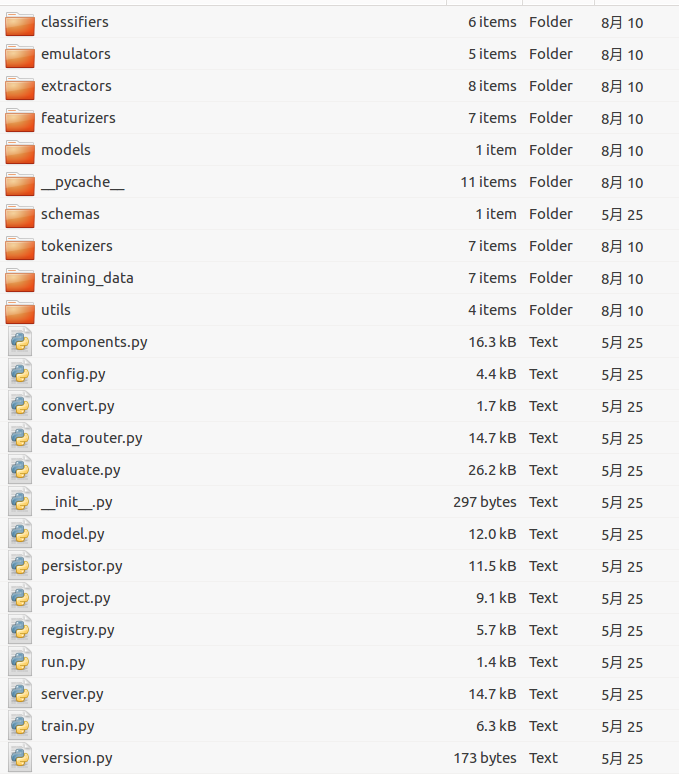
Locate an element on the screen. orange folders is located at coordinates pyautogui.click(x=10, y=23), pyautogui.click(x=14, y=85), pyautogui.click(x=20, y=53), pyautogui.click(x=20, y=122), pyautogui.click(x=20, y=149), pyautogui.click(x=14, y=189), pyautogui.click(x=12, y=219), pyautogui.click(x=15, y=252), pyautogui.click(x=12, y=280), pyautogui.click(x=9, y=315).